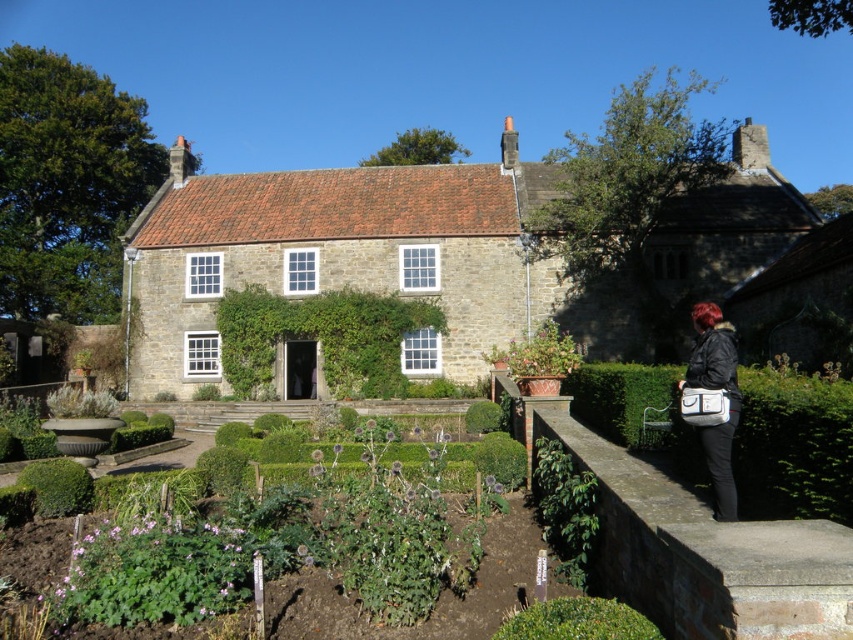
Question: Can you confirm if green leafy hedge at center is positioned to the right of black leather jacket at lower right?

Choices:
 (A) no
 (B) yes

Answer: (A)

Question: Can you confirm if stone cottage at center is positioned to the right of green leafy hedge at center?

Choices:
 (A) no
 (B) yes

Answer: (B)

Question: Estimate the real-world distances between objects in this image. Which object is farther from the black leather jacket at lower right?

Choices:
 (A) green leafy hedge at right
 (B) green leafy hedge at center

Answer: (B)

Question: Considering the real-world distances, which object is farthest from the stone cottage at center?

Choices:
 (A) green leafy hedge at right
 (B) green leafy hedge at center
 (C) brown stone ledge at lower right
 (D) black leather jacket at lower right

Answer: (C)

Question: Does stone cottage at center appear on the left side of green leafy hedge at right?

Choices:
 (A) no
 (B) yes

Answer: (B)

Question: Which is farther from the black leather jacket at lower right?

Choices:
 (A) stone cottage at center
 (B) green leafy hedge at right
 (C) green leafy hedge at center
 (D) brown stone ledge at lower right

Answer: (C)